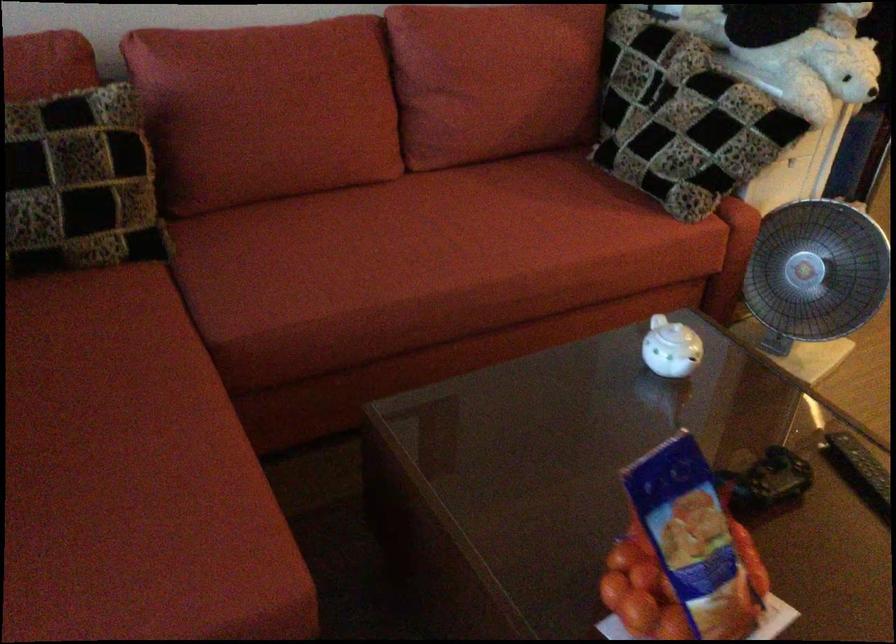
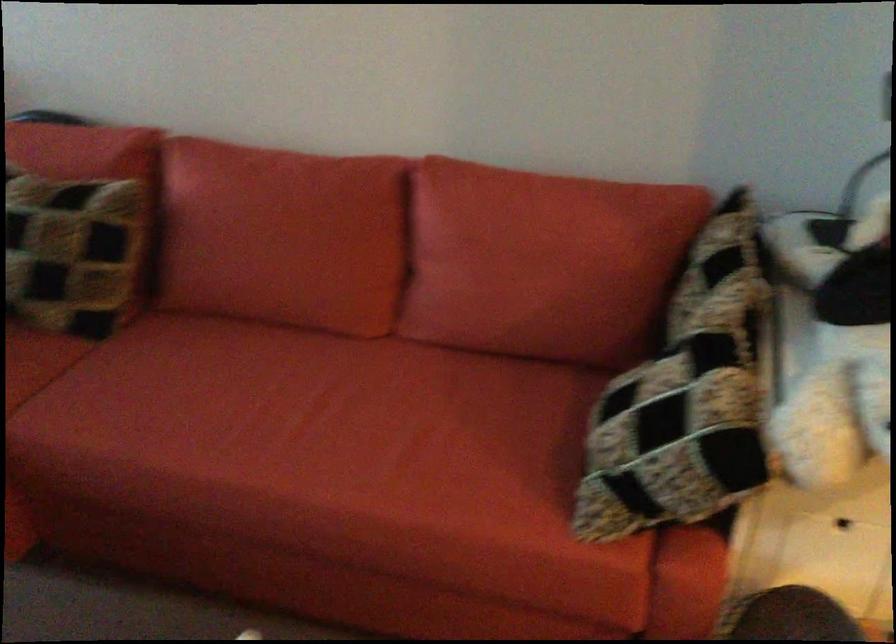
Find the pixel in the second image that matches pixel 298 102 in the first image.

(282, 236)